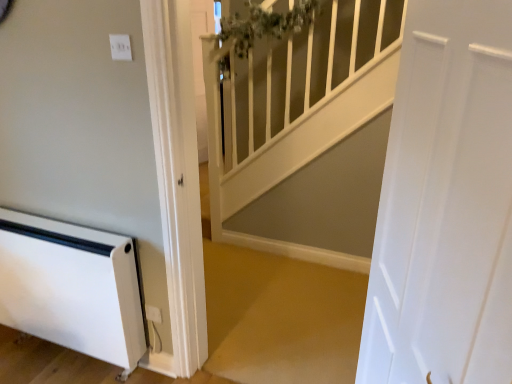
Question: Is white glossy banister at upper center situated inside white smooth door at right or outside?

Choices:
 (A) outside
 (B) inside

Answer: (A)

Question: From a real-world perspective, relative to white smooth door at right, is white glossy banister at upper center vertically above or below?

Choices:
 (A) above
 (B) below

Answer: (B)

Question: Estimate the real-world distances between objects in this image. Which object is farther from the white plastic electric outlet at lower center?

Choices:
 (A) white glossy banister at upper center
 (B) white plastic heater at lower left
 (C) white smooth door at right

Answer: (A)

Question: Considering the real-world distances, which object is closest to the white plastic electric outlet at lower center?

Choices:
 (A) white glossy banister at upper center
 (B) white plastic heater at lower left
 (C) white smooth door at right

Answer: (B)